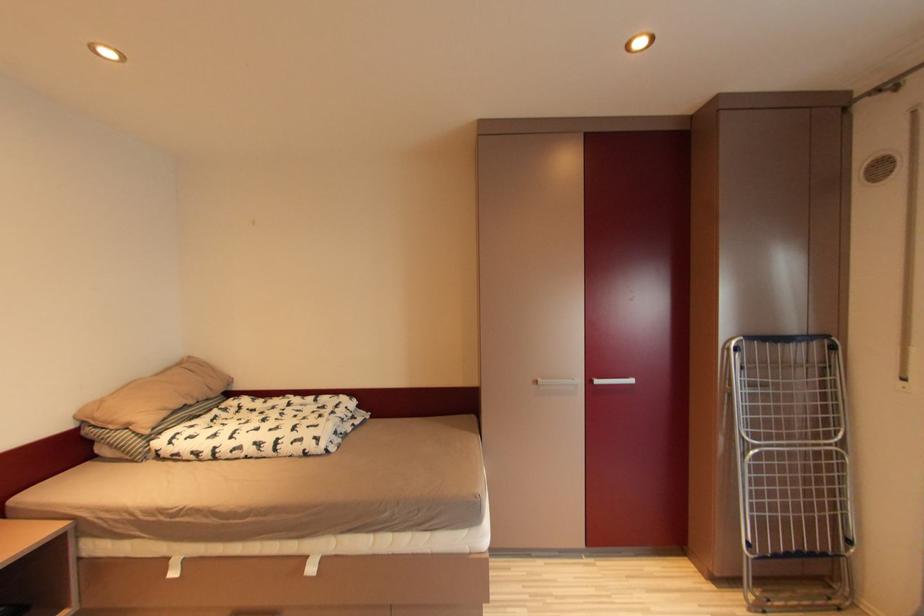
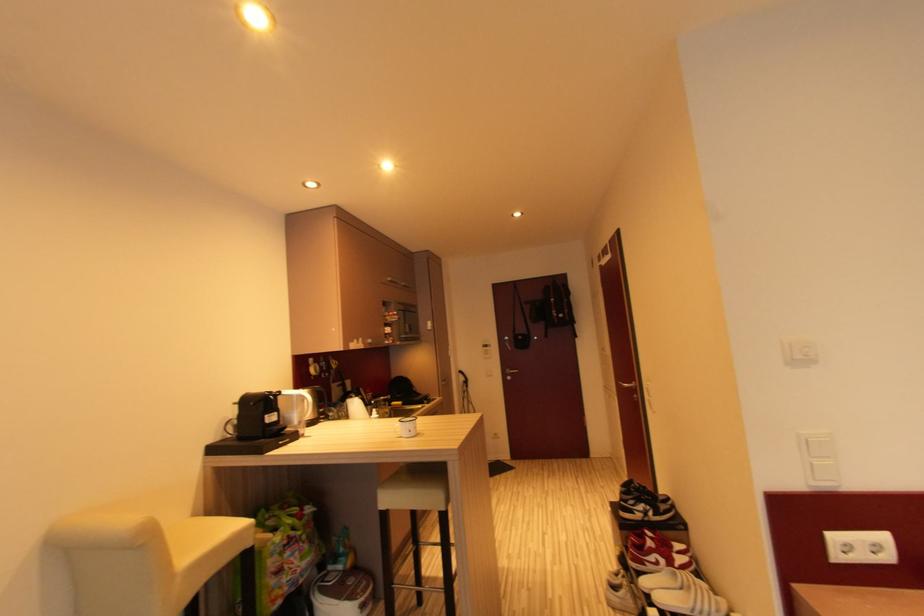
Question: Based on the continuous images, in which direction is the camera rotating? Reply with the corresponding letter.

Choices:
 (A) Left
 (B) Right
 (C) Up
 (D) Down

Answer: (A)